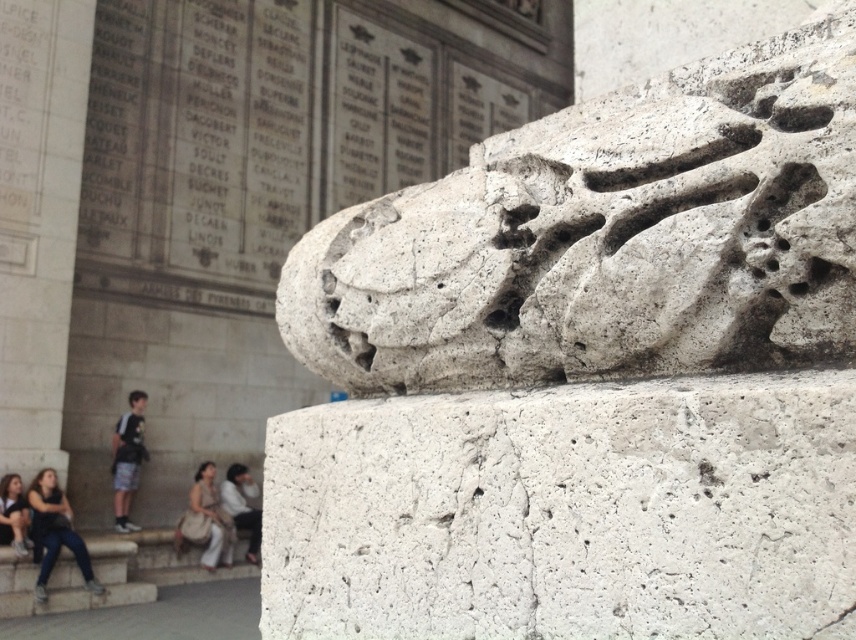
Question: Is white stone lion at upper center above white rough stone lion at upper center?

Choices:
 (A) no
 (B) yes

Answer: (B)

Question: Does light blue denim shorts at lower left have a greater width compared to light beige fabric pants at lower center?

Choices:
 (A) no
 (B) yes

Answer: (A)

Question: Which of the following is the farthest from the observer?

Choices:
 (A) light beige fabric pants at lower center
 (B) white rough stone lion at upper center
 (C) light beige pants at lower left

Answer: (A)

Question: Which object is positioned closest to the light beige fabric pants at lower center?

Choices:
 (A) white rough stone lion at upper center
 (B) light beige pants at lower left

Answer: (B)

Question: Which point is farther from the camera taking this photo?

Choices:
 (A) (722, 621)
 (B) (13, 529)
 (C) (792, 90)
 (D) (135, 445)

Answer: (D)

Question: Is light blue denim shorts at lower left below light beige pants at lower left?

Choices:
 (A) no
 (B) yes

Answer: (A)